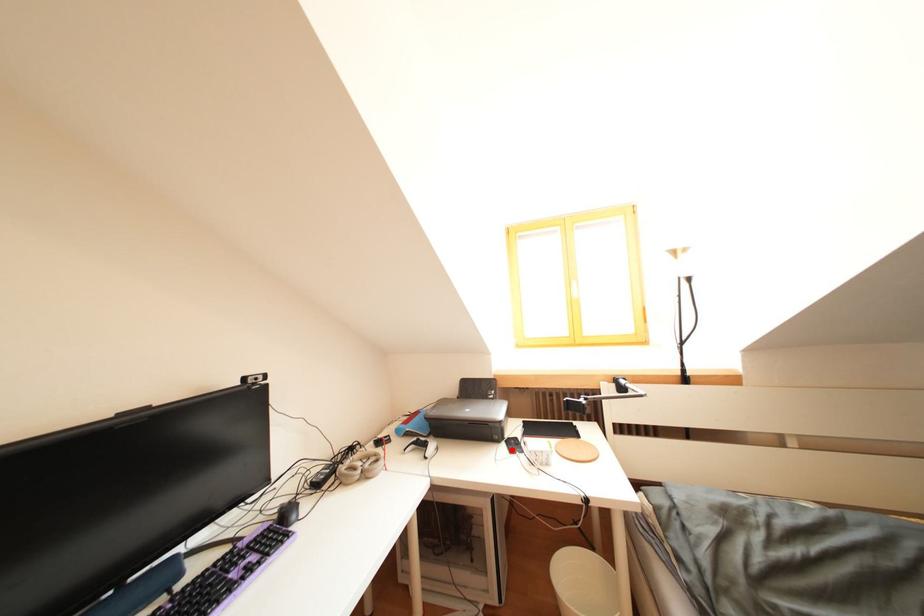
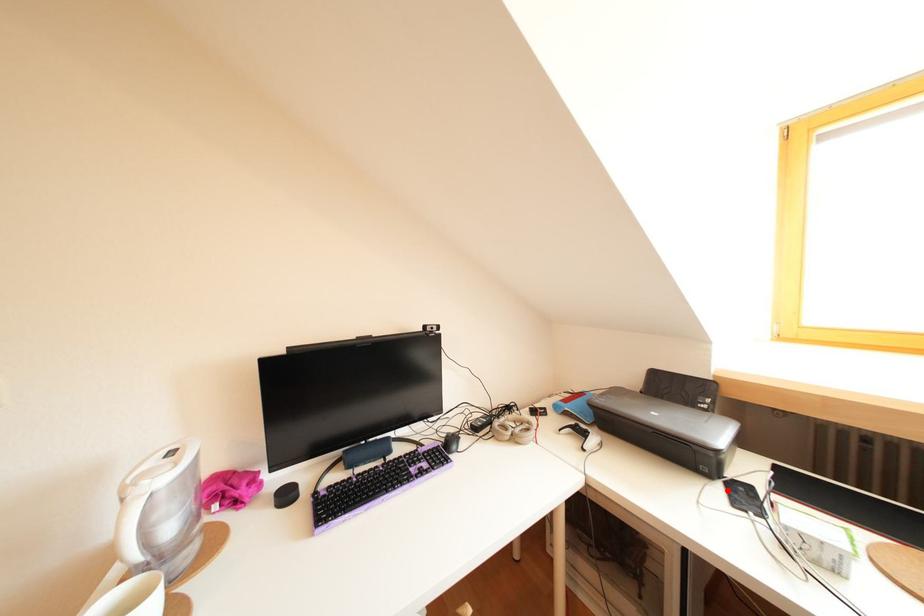
Looking at this image, I am providing you with two images of the same scene from different viewpoints. A red point is marked on the first image and another point is marked on the second image. Are the points marked in image1 and image2 representing the same 3D position?

Yes